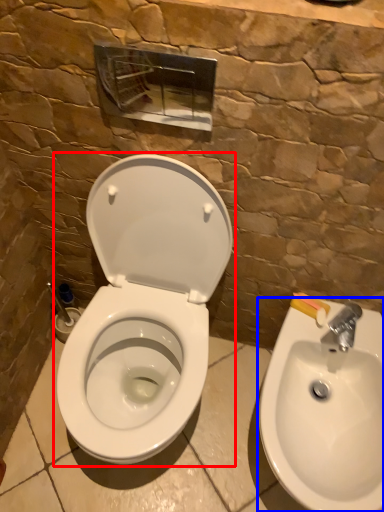
Question: Which of the following is the closest to the observer, toilet (highlighted by a red box) or sink (highlighted by a blue box)?

Choices:
 (A) toilet
 (B) sink

Answer: (A)